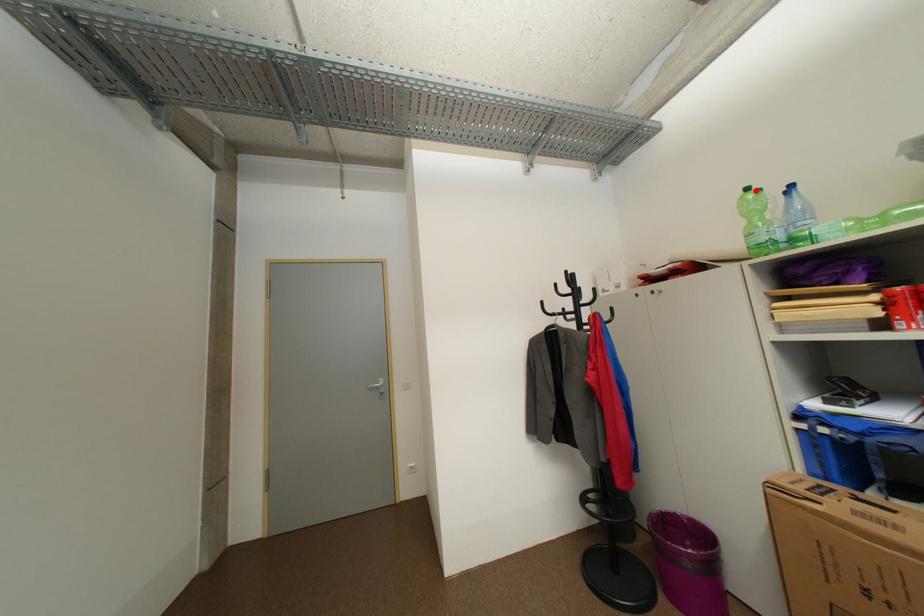
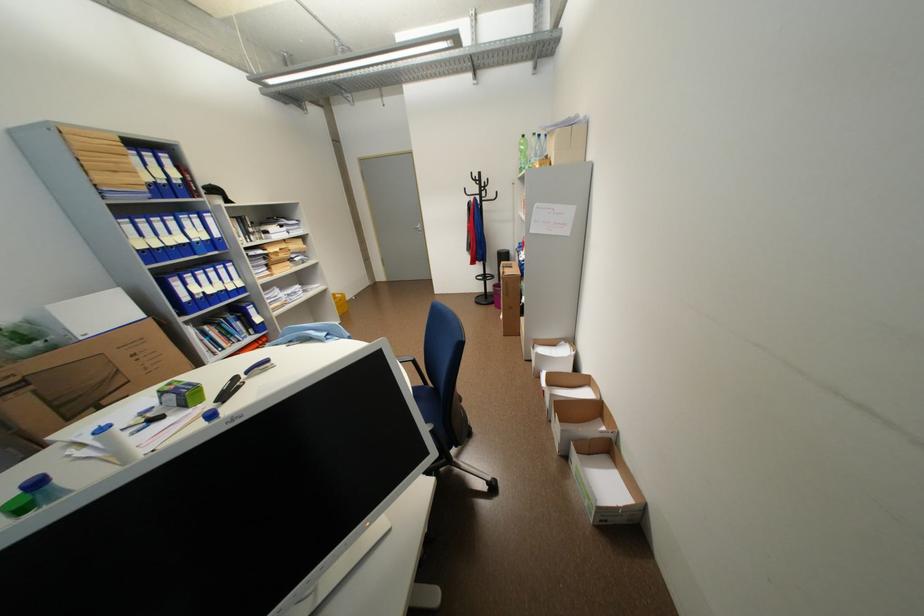
The point at the highlighted location is marked in the first image. Where is the corresponding point in the second image?

(531, 137)